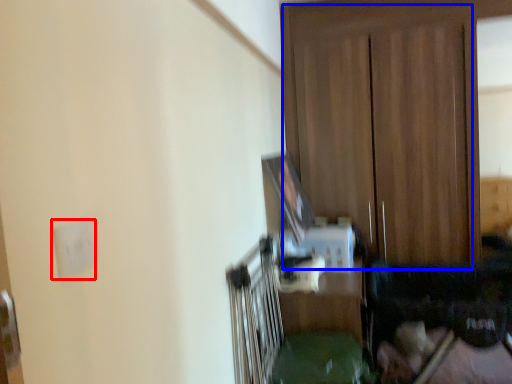
Question: Which object appears farthest to the camera in this image, electric outlet (highlighted by a red box) or dresser (highlighted by a blue box)?

Choices:
 (A) electric outlet
 (B) dresser

Answer: (B)